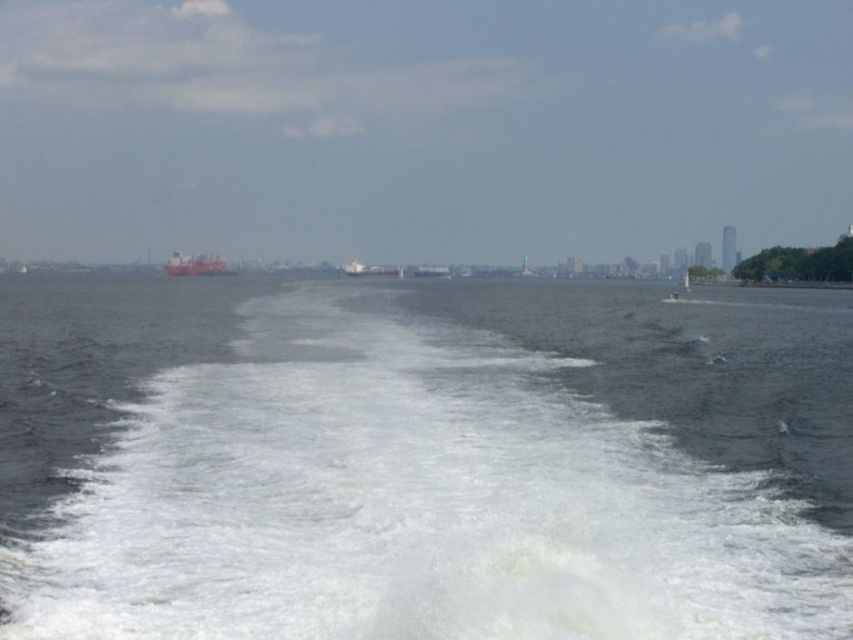
Can you confirm if white foamy water at center is positioned below red matte cargo ship at center?

Indeed, white foamy water at center is positioned under red matte cargo ship at center.

Is the position of white foamy water at center more distant than that of red matte cargo ship at center?

That is False.

Is point (625, 340) closer to camera compared to point (218, 266)?

Yes, point (625, 340) is in front of point (218, 266).

The height and width of the screenshot is (640, 853). I want to click on white foamy water at center, so click(x=421, y=460).